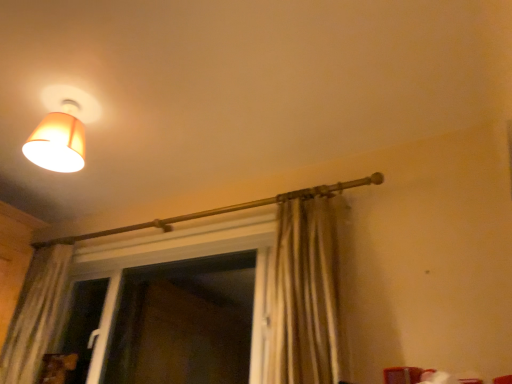
At what (x,y) coordinates should I click in order to perform the action: click on transparent plastic screen door at lower left. Please return your answer as a coordinate pair (x, y). This screenshot has height=384, width=512. Looking at the image, I should click on (184, 322).

Measure the distance between transparent plastic screen door at lower left and camera.

transparent plastic screen door at lower left is 2.72 meters from camera.

Looking at this image, in order to face transparent plastic screen door at lower left, should I rotate leftwards or rightwards?

Rotate your view left by about 13.628°.

This screenshot has width=512, height=384. Describe the element at coordinates (184, 322) in the screenshot. I see `transparent plastic screen door at lower left` at that location.

Identify the location of transparent plastic screen door at lower left. The width and height of the screenshot is (512, 384). (184, 322).